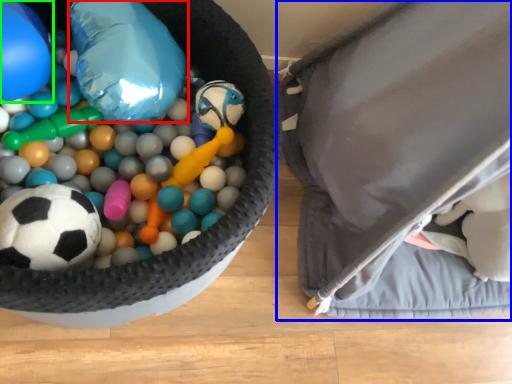
Question: Which object is the closest to the balloon (highlighted by a red box)? Choose among these: bean bag chair (highlighted by a blue box) or balloon (highlighted by a green box).

Choices:
 (A) bean bag chair
 (B) balloon

Answer: (B)